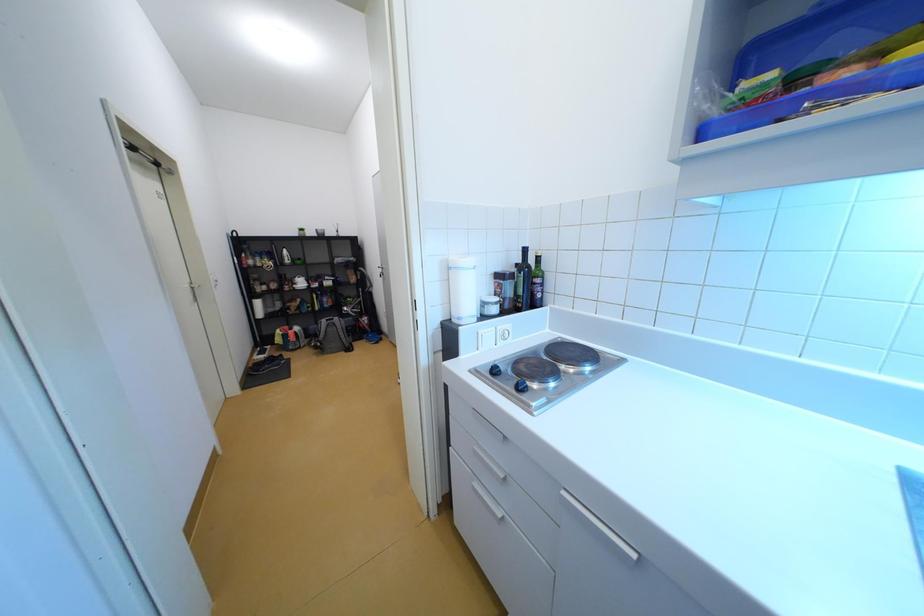
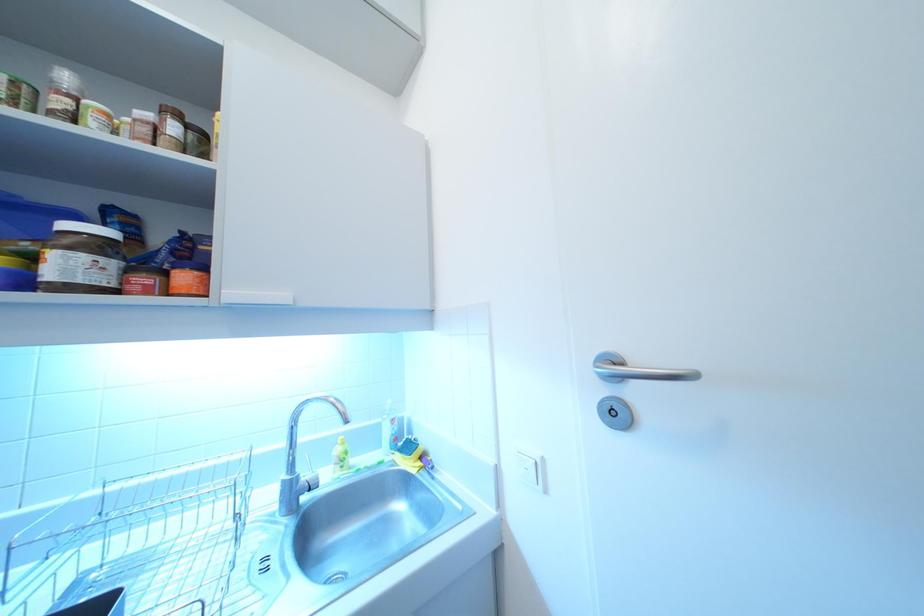
Question: The camera is either moving clockwise (left) or counter-clockwise (right) around the object. The first image is from the beginning of the video and the second image is from the end. Is the camera moving left or right when shooting the video?

Choices:
 (A) Left
 (B) Right

Answer: (A)